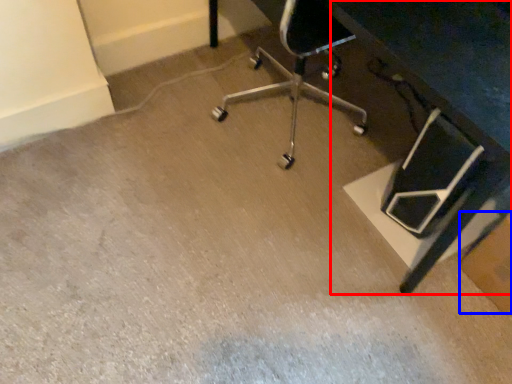
Question: Which of the following is the farthest to the observer, table (highlighted by a red box) or cardboard box (highlighted by a blue box)?

Choices:
 (A) table
 (B) cardboard box

Answer: (B)